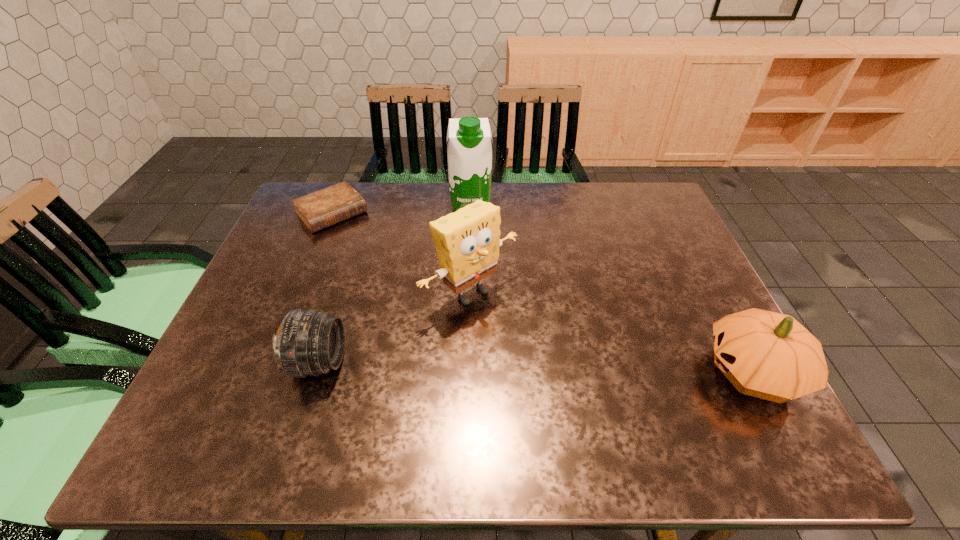
You are a GUI agent. You are given a task and a screenshot of the screen. Output one action in this format:
    pyautogui.click(x=<x>, y=<y>)
    Task: Click on the second shortest object
    
    Given the screenshot: What is the action you would take?
    pyautogui.click(x=309, y=342)

Find the location of `the rightmost object`. the rightmost object is located at coordinates (768, 355).

Where is `gourd`? gourd is located at coordinates (768, 355).

Find the location of a particular element. diary is located at coordinates (321, 209).

Where is `the tallest object`? the tallest object is located at coordinates (469, 151).

This screenshot has width=960, height=540. I want to click on sponge, so click(x=467, y=242).

Locate an element on the screen. This screenshot has width=960, height=540. the second tallest object is located at coordinates pos(467,242).

Find the location of a particular element. The width and height of the screenshot is (960, 540). free spot located 0.140m at the front element of the telephoto lens is located at coordinates (408, 362).

Image resolution: width=960 pixels, height=540 pixels. Identify the location of free point located on the side of the rightmost object with the carved face. (560, 372).

Locate an element on the screen. vacant space located on the side of the rightmost object with the carved face is located at coordinates (681, 372).